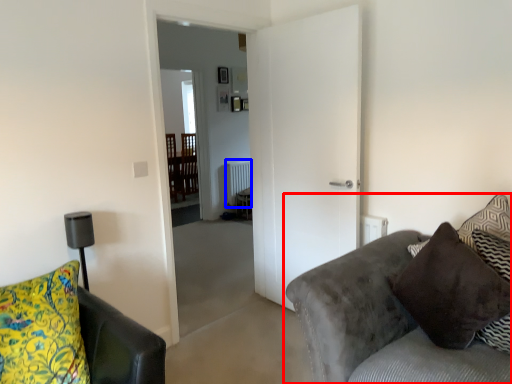
Question: Which object is further to the camera taking this photo, studio couch (highlighted by a red box) or radiator (highlighted by a blue box)?

Choices:
 (A) studio couch
 (B) radiator

Answer: (B)